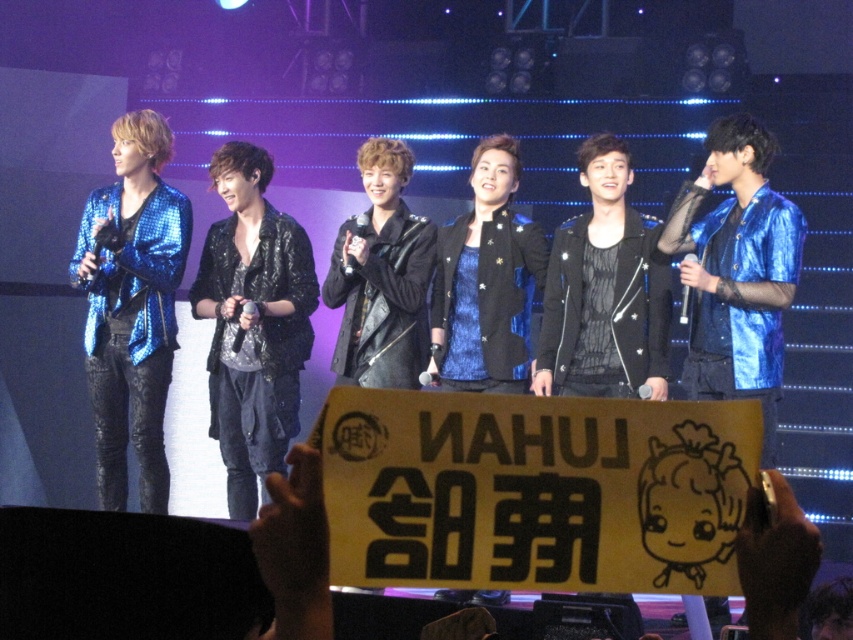
Question: Which object is closer to the camera taking this photo?

Choices:
 (A) shiny blue jacket at left
 (B) shiny blue jacket at right

Answer: (B)

Question: Does shiny black jacket at center appear on the left side of shiny blue jacket at right?

Choices:
 (A) yes
 (B) no

Answer: (A)

Question: Is shiny black jacket at center bigger than shiny blue jacket at right?

Choices:
 (A) yes
 (B) no

Answer: (B)

Question: Among these objects, which one is nearest to the camera?

Choices:
 (A) shiny blue jacket at left
 (B) black leather jacket at center
 (C) shiny blue jacket at right
 (D) shiny black jacket at center

Answer: (C)

Question: Is shiny blue jacket at left above black leather jacket at center?

Choices:
 (A) yes
 (B) no

Answer: (B)

Question: Which point is farther from the camera taking this photo?

Choices:
 (A) (727, 136)
 (B) (305, 272)
 (C) (128, 380)

Answer: (B)